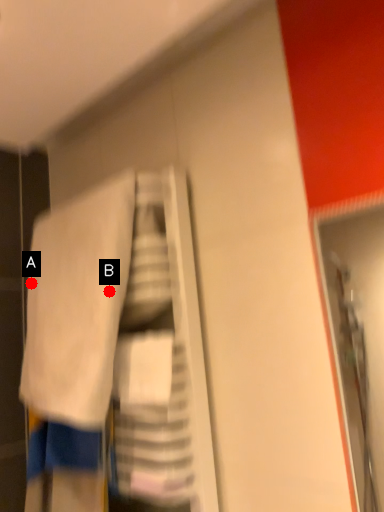
Question: Two points are circled on the image, labeled by A and B beside each circle. Which point is closer to the camera?

Choices:
 (A) A is closer
 (B) B is closer

Answer: (B)